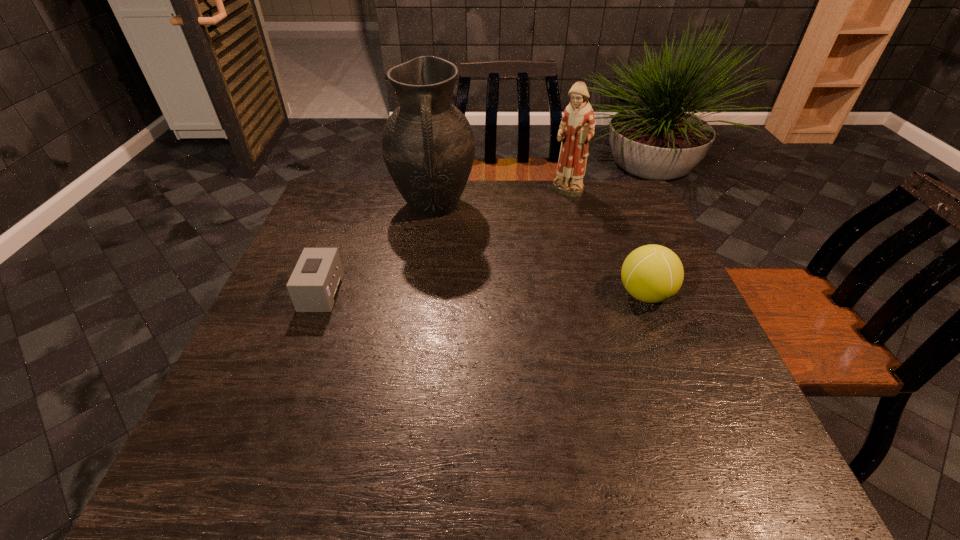
Identify the location of empty space that is in between the tallest object and the alarm clock. This screenshot has height=540, width=960. (377, 249).

The image size is (960, 540). Identify the location of free area in between the tennis ball and the tallest object. (540, 251).

At what (x,y) coordinates should I click in order to perform the action: click on vacant space that is in between the figurine and the tennis ball. Please return your answer as a coordinate pair (x, y). The image size is (960, 540). Looking at the image, I should click on (607, 244).

The width and height of the screenshot is (960, 540). Identify the location of object identified as the closest to the second tallest object. (428, 146).

This screenshot has height=540, width=960. Identify the location of object that stands as the third closest to the alarm clock. (652, 273).

Locate an element on the screen. vacant space that satisfies the following two spatial constraints: 1. on the front side of the tennis ball; 2. on the right side of the pitcher is located at coordinates (420, 295).